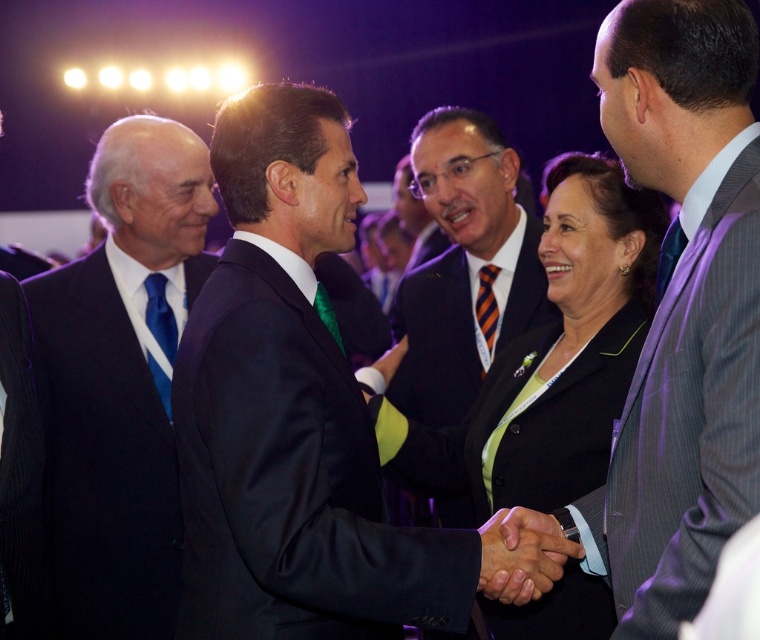
You are a photographer at the event and need to ensure that both the navy blue suit at center and the blue silk tie at center are clearly visible in your photo. Given their sizes, which one should you focus on to ensure it doesn t get lost in the background?

The navy blue suit at center is taller than the blue silk tie at center. Therefore, you should focus on the navy blue suit at center since it is larger and less likely to be obscured by the background.

You are a photographer at the event and need to capture a closeup of both the navy blue suit at center and the blue silk tie at center in the same frame. Given that your camera has a minimum focus distance of 36 inches, will you be able to achieve this?

The navy blue suit at center and blue silk tie at center are 37.05 inches apart. Since the minimum focus distance is 36 inches, the photographer can capture both in the same frame as the distance is slightly more than the required minimum.